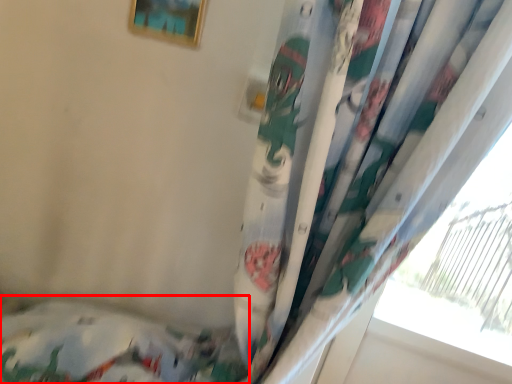
Question: From the image's perspective, what is the correct spatial relationship of bed (annotated by the red box) in relation to picture frame?

Choices:
 (A) above
 (B) below

Answer: (B)